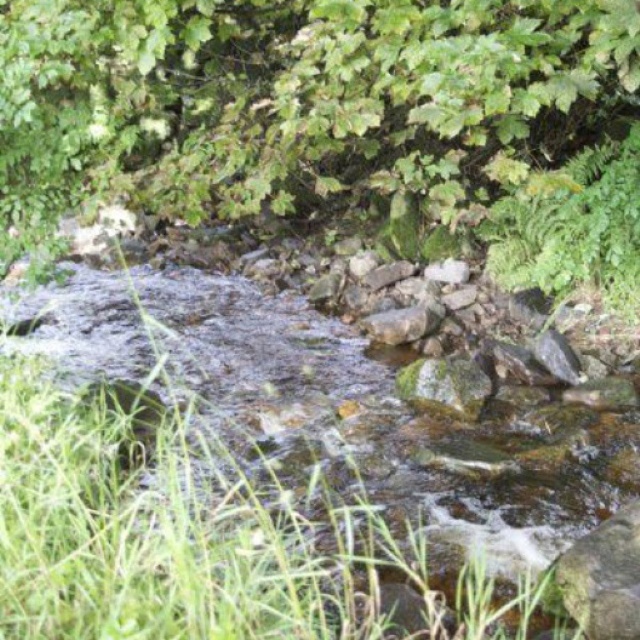
Question: Can you confirm if green grass at center is thinner than smooth gray rock at lower right?

Choices:
 (A) yes
 (B) no

Answer: (B)

Question: Does green grass at center appear on the left side of smooth gray rock at lower right?

Choices:
 (A) yes
 (B) no

Answer: (A)

Question: Which point is closer to the camera taking this photo?

Choices:
 (A) (636, 547)
 (B) (444, 484)

Answer: (A)

Question: Does green grass at center come in front of smooth gray rock at lower right?

Choices:
 (A) yes
 (B) no

Answer: (A)